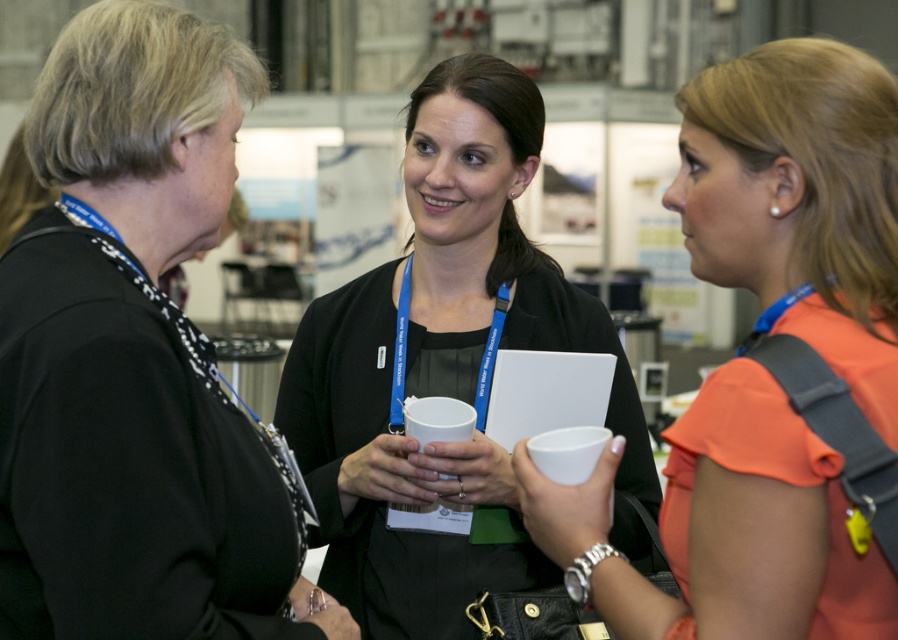
Question: Is orange fabric dress at right below matte black jacket at center?

Choices:
 (A) no
 (B) yes

Answer: (A)

Question: Estimate the real-world distances between objects in this image. Which object is closer to the black fabric jacket at upper left?

Choices:
 (A) matte black jacket at center
 (B) orange fabric dress at right

Answer: (A)

Question: Which object is farther from the camera taking this photo?

Choices:
 (A) matte black jacket at center
 (B) black fabric jacket at upper left

Answer: (A)

Question: Can you confirm if orange fabric dress at right is bigger than matte black jacket at center?

Choices:
 (A) no
 (B) yes

Answer: (A)

Question: Among these objects, which one is farthest from the camera?

Choices:
 (A) matte black jacket at center
 (B) black fabric jacket at upper left

Answer: (A)

Question: Is black fabric jacket at upper left thinner than matte black jacket at center?

Choices:
 (A) yes
 (B) no

Answer: (A)